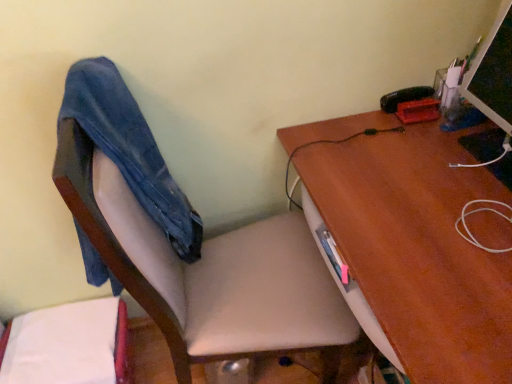
Identify the location of free space to the left of matte black monitor at upper right. This screenshot has height=384, width=512. (431, 146).